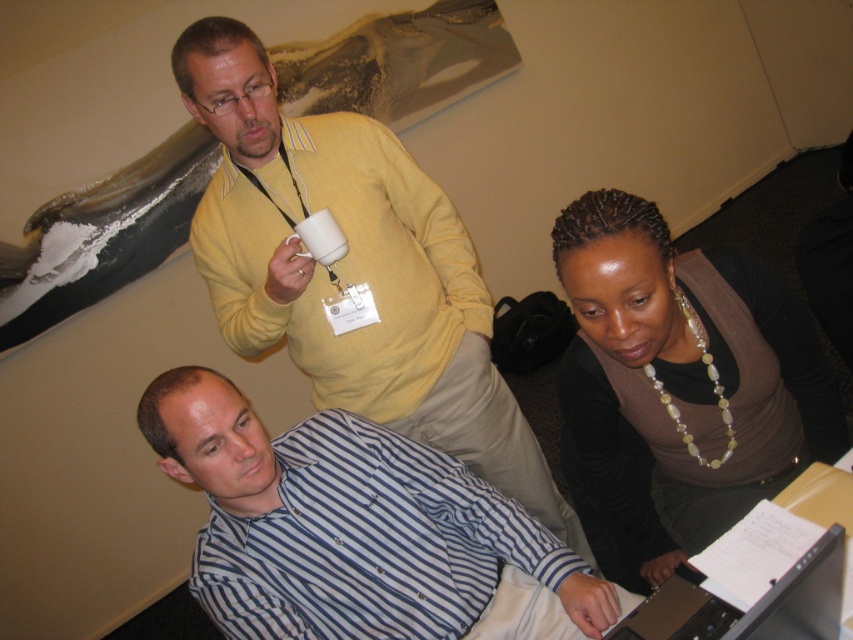
You are standing in the room and want to hand a document to the person wearing the brown matte sweater at lower right without disturbing the person in the blue striped shirt at lower left. Which direction should you approach from?

You should approach from the right side since the brown matte sweater at lower right is closer to the viewer, allowing you to reach them without getting too close to the blue striped shirt at lower left who is further away.

You are standing in the room and want to place a new picture frame on the wall. The frame is 15 inches tall. You see the yellow sweater at upper center and the silver metallic laptop at lower right. Which object can the frame fit above without overlapping?

The yellow sweater at upper center is taller than the silver metallic laptop at lower right. Since the frame is 15 inches tall, it can fit above the yellow sweater at upper center as it has more vertical space available.

You are a photographer trying to capture a closeup of the abstract painting on the wall. You have to decide whether to place your tripod on the carpeted floor to the right of the brown matte sweater at lower right or to the right of the silver metallic laptop at lower right. Which location would allow the tripod to be closer to the painting?

The brown matte sweater at lower right has a greater height compared to the silver metallic laptop at lower right. Therefore, placing the tripod to the right of the silver metallic laptop at lower right would allow it to be closer to the painting since the laptop is shorter and the tripod can be positioned closer without obstruction.